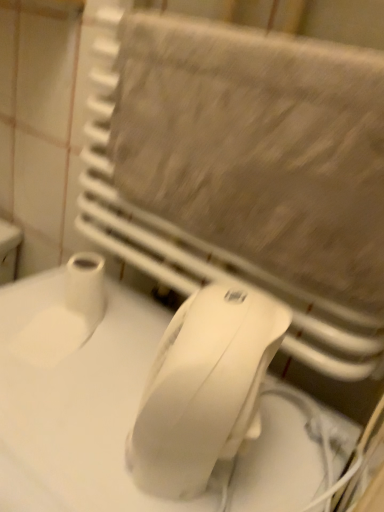
At what (x,y) coordinates should I click in order to perform the action: click on vacant space situated above white matte countertop at lower left (from a real-world perspective). Please return your answer as a coordinate pair (x, y). Looking at the image, I should click on (99, 387).